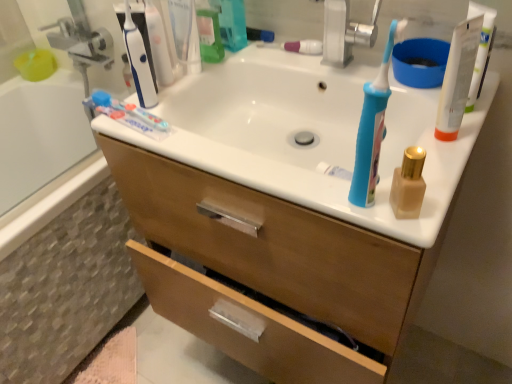
I want to click on free space to the left of matte gold bottle at right, so click(303, 190).